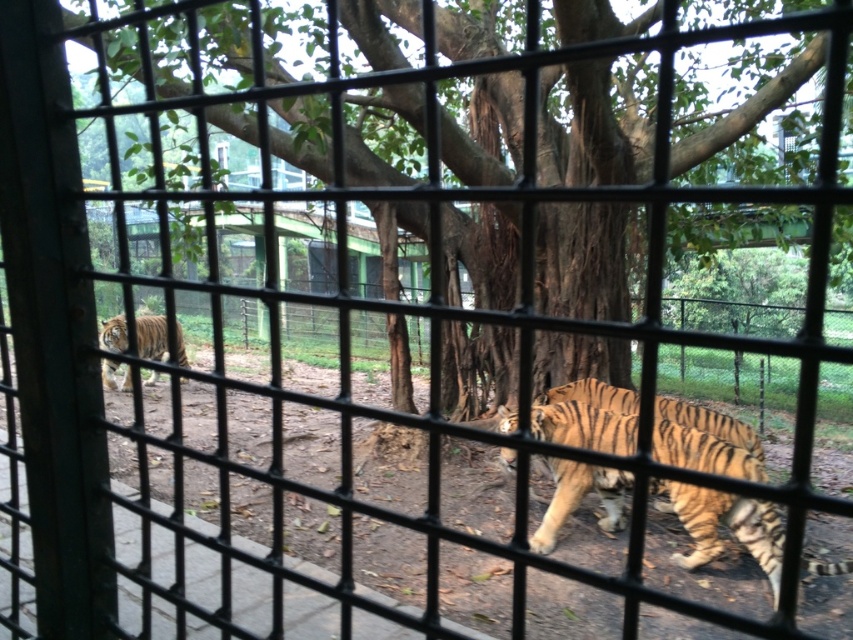
Which is below, orange striped tiger at center or orange striped tiger at left?

Positioned lower is orange striped tiger at center.

Is orange striped tiger at center smaller than orange striped tiger at left?

Yes.

The height and width of the screenshot is (640, 853). I want to click on orange striped tiger at center, so click(x=724, y=525).